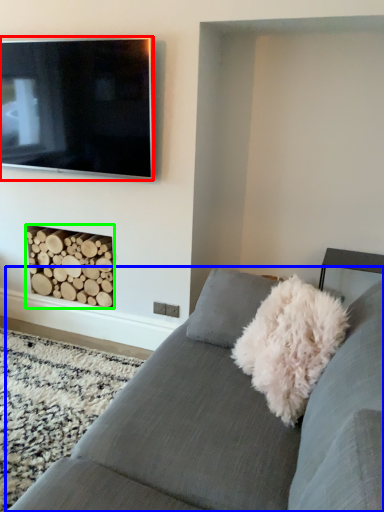
Question: Which is farther away from television (highlighted by a red box)? studio couch (highlighted by a blue box) or fireplace (highlighted by a green box)?

Choices:
 (A) studio couch
 (B) fireplace

Answer: (A)